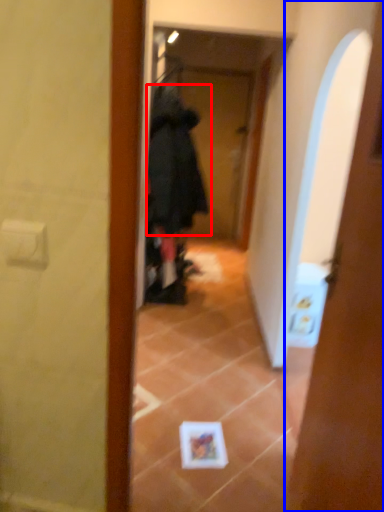
Question: Which point is further to the camera, bathrobe (highlighted by a red box) or door (highlighted by a blue box)?

Choices:
 (A) bathrobe
 (B) door

Answer: (A)